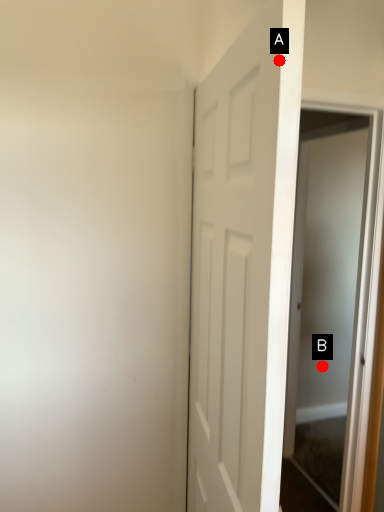
Question: Two points are circled on the image, labeled by A and B beside each circle. Which point is further to the camera?

Choices:
 (A) A is further
 (B) B is further

Answer: (B)